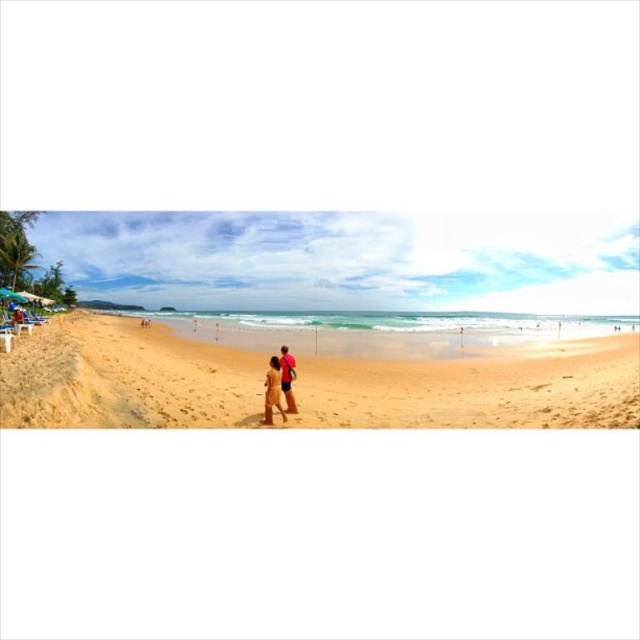
Question: Among these points, which one is nearest to the camera?

Choices:
 (A) (452, 401)
 (B) (278, 369)

Answer: (B)

Question: Which object is positioned closest to the matte red shirt at center?

Choices:
 (A) golden sand beach at center
 (B) tan skin couple at center

Answer: (B)

Question: Is golden sand beach at center wider than tan skin couple at center?

Choices:
 (A) no
 (B) yes

Answer: (B)

Question: Which point is farther from the camera taking this photo?

Choices:
 (A) (284, 360)
 (B) (86, 333)
 (C) (285, 394)

Answer: (B)

Question: Is golden sand beach at center above tan skin couple at center?

Choices:
 (A) yes
 (B) no

Answer: (A)

Question: Considering the relative positions of golden sand beach at center and matte red shirt at center in the image provided, where is golden sand beach at center located with respect to matte red shirt at center?

Choices:
 (A) above
 (B) below

Answer: (B)